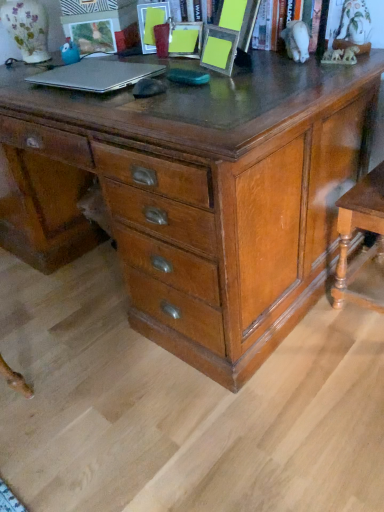
What do you see at coordinates (200, 195) in the screenshot? The width and height of the screenshot is (384, 512). I see `shiny brown wooden chest of drawers at center` at bounding box center [200, 195].

The width and height of the screenshot is (384, 512). What do you see at coordinates (92, 36) in the screenshot?
I see `matte plastic picture frame at upper left, positioned as the third picture frame in right-to-left order` at bounding box center [92, 36].

Measure the distance between point (321, 42) and camera.

The depth of point (321, 42) is 1.35 meters.

Identify the location of matte plastic picture frame at upper center, the 3th picture frame positioned from the left. The image size is (384, 512). point(185,39).

Identify the location of shiny brown wooden chest of drawers at center. This screenshot has height=512, width=384. 200,195.

Which of these two, matte plastic picture frame at upper center, the 2th picture frame when ordered from left to right, or yellow paper at upper center, stands shorter?

With less height is matte plastic picture frame at upper center, the 2th picture frame when ordered from left to right.

Based on the photo, from the image's perspective, is matte plastic picture frame at upper center, the 2th picture frame when ordered from left to right, located above or below yellow paper at upper center?

From the image's perspective, matte plastic picture frame at upper center, the 2th picture frame when ordered from left to right, appears above yellow paper at upper center.

Between matte plastic picture frame at upper center, the 2th picture frame when ordered from left to right, and yellow paper at upper center, which one appears on the right side from the viewer's perspective?

yellow paper at upper center.

From the picture: Which is in front, matte plastic picture frame at upper center, which is the second picture frame in right-to-left order, or yellow paper at upper center?

yellow paper at upper center.

Considering the points (378, 215) and (143, 14), which point is in front, point (378, 215) or point (143, 14)?

Positioned in front is point (378, 215).

Measure the distance between wooden table at lower right and matte plastic picture frame at upper center, which is the second picture frame in right-to-left order.

A distance of 3.46 feet exists between wooden table at lower right and matte plastic picture frame at upper center, which is the second picture frame in right-to-left order.

Consider the image. Would you consider wooden table at lower right to be distant from matte plastic picture frame at upper center, which is the second picture frame in right-to-left order?

Yes, wooden table at lower right is far from matte plastic picture frame at upper center, which is the second picture frame in right-to-left order.

From the wooden table at lower right, count the 2nd picture frame to the left and point to it. Please provide its 2D coordinates.

[(151, 23)]

Is wooden table at lower right at the back of shiny brown wooden chest of drawers at center?

No.

Can you tell me how much shiny brown wooden chest of drawers at center and wooden table at lower right differ in facing direction?

They differ by 0.0104 degrees in their facing directions.

From a real-world perspective, is shiny brown wooden chest of drawers at center physically above wooden table at lower right?

Correct, in the physical world, shiny brown wooden chest of drawers at center is higher than wooden table at lower right.

Which is behind, point (72, 39) or point (178, 54)?

Positioned behind is point (72, 39).

From the image's perspective, does matte plastic picture frame at upper left, positioned as the third picture frame in right-to-left order, appear higher than matte plastic picture frame at upper center, the 3th picture frame positioned from the left?

Yes, from the image's perspective, matte plastic picture frame at upper left, positioned as the third picture frame in right-to-left order, is on top of matte plastic picture frame at upper center, the 3th picture frame positioned from the left.

Would you say matte plastic picture frame at upper left, positioned as the third picture frame in right-to-left order, is to the left or to the right of matte plastic picture frame at upper center, which is the 1th picture frame from right to left, in the picture?

Clearly, matte plastic picture frame at upper left, positioned as the third picture frame in right-to-left order, is on the left of matte plastic picture frame at upper center, which is the 1th picture frame from right to left, in the image.

Considering the sizes of objects silver metallic laptop at upper left and wooden table at lower right in the image provided, who is shorter, silver metallic laptop at upper left or wooden table at lower right?

Standing shorter between the two is silver metallic laptop at upper left.

In terms of size, does silver metallic laptop at upper left appear bigger or smaller than wooden table at lower right?

Considering their sizes, silver metallic laptop at upper left takes up less space than wooden table at lower right.

Which object is further away from the camera, silver metallic laptop at upper left or wooden table at lower right?

Positioned behind is silver metallic laptop at upper left.

Is silver metallic laptop at upper left to the left or to the right of wooden table at lower right in the image?

Based on their positions, silver metallic laptop at upper left is located to the left of wooden table at lower right.

From the image's perspective, would you say matte plastic picture frame at upper center, the 2th picture frame when ordered from left to right, is positioned over silver metallic laptop at upper left?

Correct, matte plastic picture frame at upper center, the 2th picture frame when ordered from left to right, appears higher than silver metallic laptop at upper left in the image.

Considering the relative positions of matte plastic picture frame at upper center, which is the second picture frame in right-to-left order, and silver metallic laptop at upper left in the image provided, is matte plastic picture frame at upper center, which is the second picture frame in right-to-left order, in front of silver metallic laptop at upper left?

No.

Consider the image. Considering the relative sizes of matte plastic picture frame at upper center, which is the second picture frame in right-to-left order, and silver metallic laptop at upper left in the image provided, is matte plastic picture frame at upper center, which is the second picture frame in right-to-left order, taller than silver metallic laptop at upper left?

Yes, matte plastic picture frame at upper center, which is the second picture frame in right-to-left order, is taller than silver metallic laptop at upper left.

Can you confirm if shiny brown wooden chest of drawers at center is positioned to the right of matte plastic picture frame at upper center, the 3th picture frame positioned from the left?

Incorrect, shiny brown wooden chest of drawers at center is not on the right side of matte plastic picture frame at upper center, the 3th picture frame positioned from the left.

Would you consider shiny brown wooden chest of drawers at center to be distant from matte plastic picture frame at upper center, the 3th picture frame positioned from the left?

No, shiny brown wooden chest of drawers at center is in close proximity to matte plastic picture frame at upper center, the 3th picture frame positioned from the left.

Relative to matte plastic picture frame at upper center, which is the 1th picture frame from right to left, is shiny brown wooden chest of drawers at center in front or behind?

shiny brown wooden chest of drawers at center is positioned closer to the viewer than matte plastic picture frame at upper center, which is the 1th picture frame from right to left.

Consider the image. Considering the sizes of shiny brown wooden chest of drawers at center and matte plastic picture frame at upper center, which is the 1th picture frame from right to left, in the image, is shiny brown wooden chest of drawers at center wider or thinner than matte plastic picture frame at upper center, which is the 1th picture frame from right to left,?

Clearly, shiny brown wooden chest of drawers at center has more width compared to matte plastic picture frame at upper center, which is the 1th picture frame from right to left.

Identify the location of picture frame that is the 2nd one when counting leftward from the yellow paper at upper center. Image resolution: width=384 pixels, height=512 pixels. (151, 23).

Where is `table below the matte plastic picture frame at upper center, which is the second picture frame in right-to-left order (from the image's perspective)`? This screenshot has height=512, width=384. table below the matte plastic picture frame at upper center, which is the second picture frame in right-to-left order (from the image's perspective) is located at coordinates (359, 229).

From the image, which object appears to be farther from matte plastic picture frame at upper left, positioned as the third picture frame in right-to-left order, shiny brown wooden chest of drawers at center or wooden table at lower right?

wooden table at lower right lies further to matte plastic picture frame at upper left, positioned as the third picture frame in right-to-left order, than the other object.

When comparing their distances from matte plastic picture frame at upper center, which is the 1th picture frame from right to left, does matte plastic picture frame at upper left, positioned as the third picture frame in right-to-left order, or shiny brown wooden chest of drawers at center seem closer?

matte plastic picture frame at upper left, positioned as the third picture frame in right-to-left order, lies closer to matte plastic picture frame at upper center, which is the 1th picture frame from right to left, than the other object.

Which object lies further to the anchor point yellow paper at upper center, shiny brown wooden chest of drawers at center or matte plastic picture frame at upper center, which is the 1th picture frame from right to left?

shiny brown wooden chest of drawers at center is positioned further to the anchor yellow paper at upper center.

Considering their positions, is matte plastic picture frame at upper left, which is the first picture frame from left to right, positioned closer to wooden table at lower right than silver metallic laptop at upper left?

silver metallic laptop at upper left lies closer to wooden table at lower right than the other object.

When comparing their distances from yellow paper at upper center, does matte plastic picture frame at upper center, the 2th picture frame when ordered from left to right, or wooden table at lower right seem further?

Based on the image, matte plastic picture frame at upper center, the 2th picture frame when ordered from left to right, appears to be further to yellow paper at upper center.

From the image, which object appears to be farther from shiny brown wooden chest of drawers at center, yellow paper at upper center or matte plastic picture frame at upper center, the 2th picture frame when ordered from left to right?

Among the two, matte plastic picture frame at upper center, the 2th picture frame when ordered from left to right, is located further to shiny brown wooden chest of drawers at center.

Looking at the image, which one is located closer to matte plastic picture frame at upper center, the 2th picture frame when ordered from left to right, matte plastic picture frame at upper center, the 3th picture frame positioned from the left, or matte plastic picture frame at upper left, positioned as the third picture frame in right-to-left order?

Based on the image, matte plastic picture frame at upper center, the 3th picture frame positioned from the left, appears to be nearer to matte plastic picture frame at upper center, the 2th picture frame when ordered from left to right.

Which object lies nearer to the anchor point wooden table at lower right, matte plastic picture frame at upper center, the 2th picture frame when ordered from left to right, or matte plastic picture frame at upper center, the 3th picture frame positioned from the left?

Among the two, matte plastic picture frame at upper center, the 3th picture frame positioned from the left, is located nearer to wooden table at lower right.

This screenshot has height=512, width=384. I want to click on laptop between matte plastic picture frame at upper left, positioned as the third picture frame in right-to-left order, and yellow paper at upper center, in the horizontal direction, so click(x=97, y=75).

Locate an element on the screen. The height and width of the screenshot is (512, 384). the chest of drawers located between silver metallic laptop at upper left and wooden table at lower right in the left-right direction is located at coordinates (200, 195).

Where is `the chest of drawers located between matte plastic picture frame at upper left, which is the first picture frame from left to right, and wooden table at lower right in the left-right direction`? The image size is (384, 512). the chest of drawers located between matte plastic picture frame at upper left, which is the first picture frame from left to right, and wooden table at lower right in the left-right direction is located at coordinates (200, 195).

At what (x,y) coordinates should I click in order to perform the action: click on chest of drawers between silver metallic laptop at upper left and yellow paper at upper center from left to right. Please return your answer as a coordinate pair (x, y). Looking at the image, I should click on (200, 195).